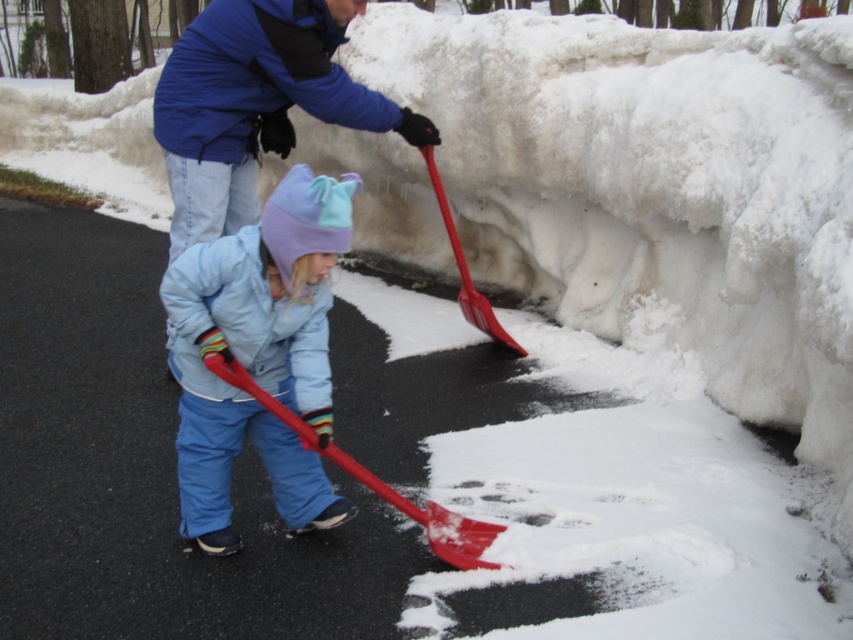
You are a parent trying to help your child with snow shoveling. You see the light blue fleece jacket at center and the red plastic shovel at lower center. Which object is taller?

The light blue fleece jacket at center is much taller than the red plastic shovel at lower center.

You are standing at the origin point of the image coordinate system. The red plastic shovel at lower center is your target. Which direction should you move to reach it?

The red plastic shovel at lower center is located at coordinates point [378,481]. Since you are at the origin, you should move right and up to reach it.